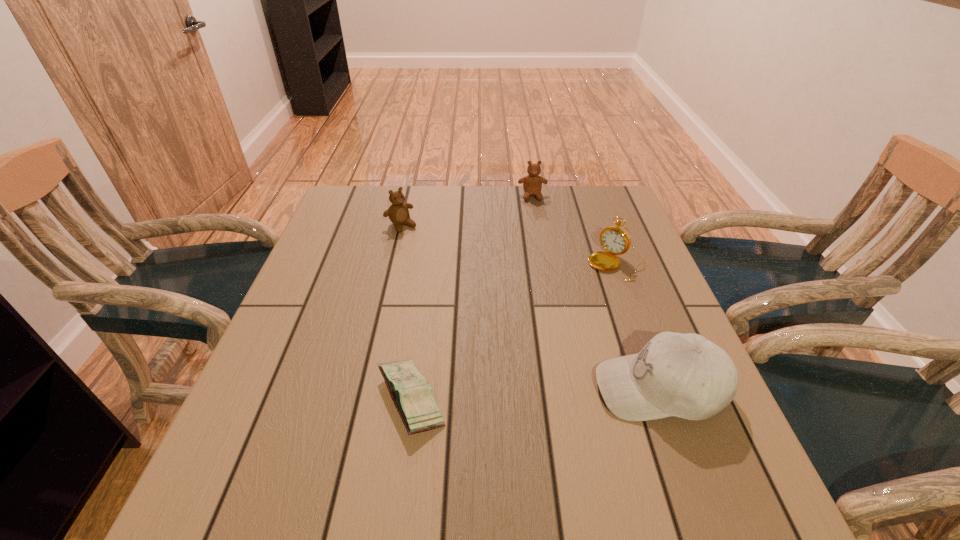
The image size is (960, 540). In order to click on diary positioned at the near edge in this screenshot , I will do `click(413, 397)`.

The width and height of the screenshot is (960, 540). I want to click on baseball cap at the near edge, so click(685, 375).

You are a GUI agent. You are given a task and a screenshot of the screen. Output one action in this format:
    pyautogui.click(x=<x>, y=<y>)
    Task: Click on the baseball cap at the right edge
    
    Given the screenshot: What is the action you would take?
    pyautogui.click(x=685, y=375)

The height and width of the screenshot is (540, 960). I want to click on pocket watch that is at the right edge, so click(615, 240).

In order to click on object at the near right corner in this screenshot , I will do `click(685, 375)`.

In the image, there is a desktop. Where is `free region at the far edge`? This screenshot has height=540, width=960. free region at the far edge is located at coordinates (545, 212).

The image size is (960, 540). What are the coordinates of `vacant space at the near edge` in the screenshot? It's located at (329, 428).

You are a GUI agent. You are given a task and a screenshot of the screen. Output one action in this format:
    pyautogui.click(x=<x>, y=<y>)
    Task: Click on the vacant space at the left edge
    The image size is (960, 540).
    Given the screenshot: What is the action you would take?
    pyautogui.click(x=330, y=294)

Locate an element on the screen. This screenshot has height=540, width=960. vacant space at the right edge is located at coordinates (583, 242).

The width and height of the screenshot is (960, 540). In order to click on vacant position at the far left corner of the desktop in this screenshot , I will do `click(388, 203)`.